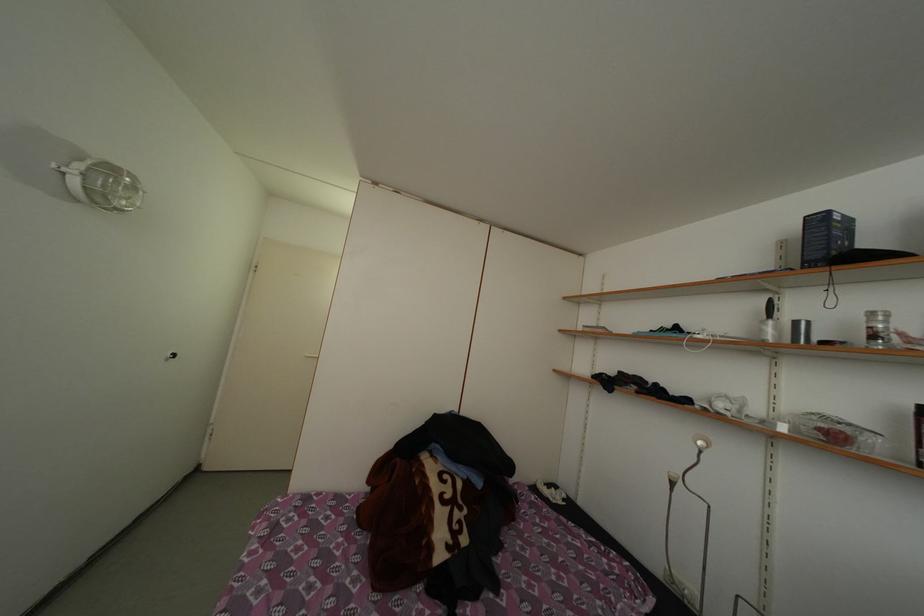
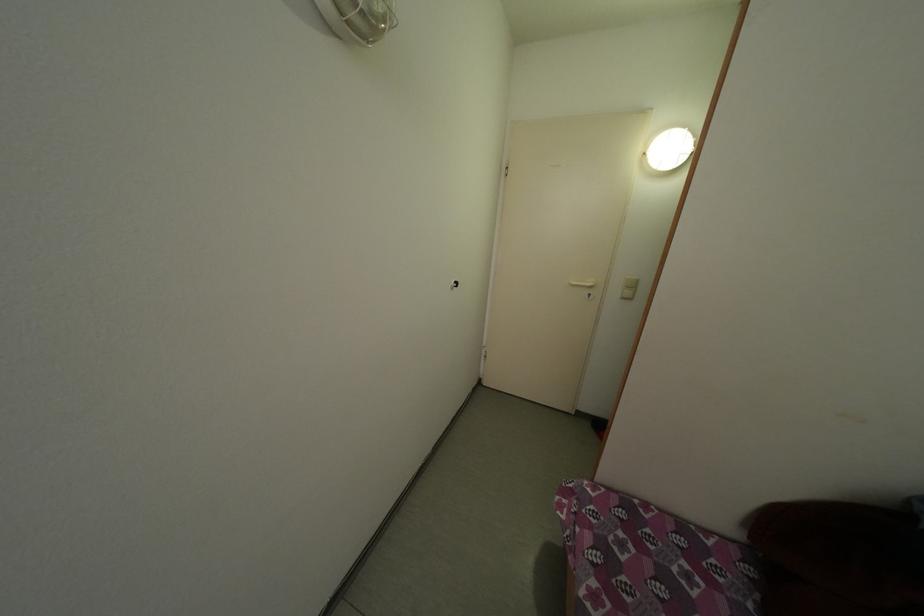
The images are taken continuously from a first-person perspective. In which direction is your viewpoint rotating?

The camera's rotation is toward left-down.